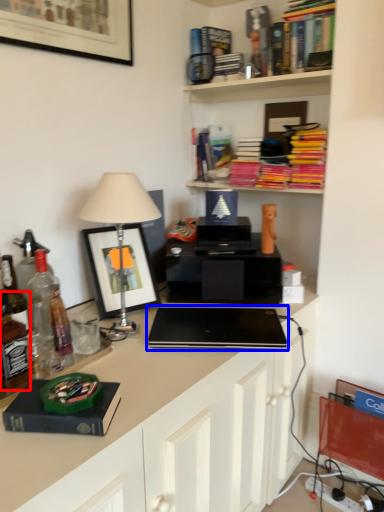
Question: Which of the following is the farthest to the observer, wine bottle (highlighted by a red box) or laptop (highlighted by a blue box)?

Choices:
 (A) wine bottle
 (B) laptop

Answer: (B)